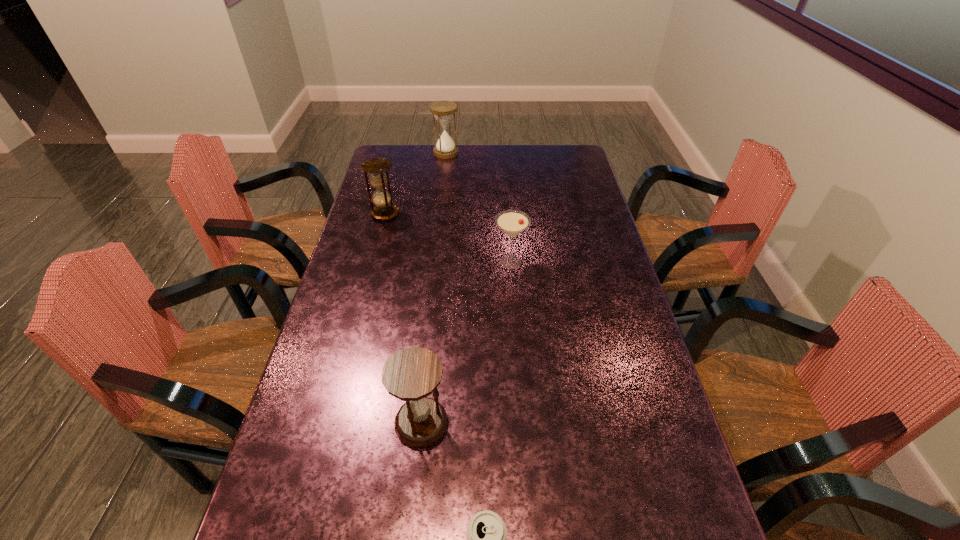
The height and width of the screenshot is (540, 960). Identify the location of object at the far edge. (443, 111).

Identify the location of object that is at the left edge. Image resolution: width=960 pixels, height=540 pixels. (376, 167).

This screenshot has height=540, width=960. Identify the location of blank space at the far edge of the desktop. (536, 172).

Identify the location of free space at the left edge of the desktop. (375, 220).

The height and width of the screenshot is (540, 960). I want to click on vacant space at the right edge, so click(612, 457).

Identify the location of free spot at the far right corner of the desktop. (577, 150).

You are a GUI agent. You are given a task and a screenshot of the screen. Output one action in this format:
    pyautogui.click(x=<x>, y=<y>)
    Task: Click on the vacant area between the martini and the fourth nearest object
    The image size is (960, 540).
    Given the screenshot: What is the action you would take?
    pyautogui.click(x=447, y=238)

What are the coordinates of `free space between the farthest hourglass and the fourth nearest object` in the screenshot? It's located at (416, 183).

Where is `blank region between the farthest hourglass and the leftmost object`? The height and width of the screenshot is (540, 960). blank region between the farthest hourglass and the leftmost object is located at coordinates pos(416,183).

Locate an element on the screen. free spot between the fourth farthest object and the second farthest object is located at coordinates (403, 318).